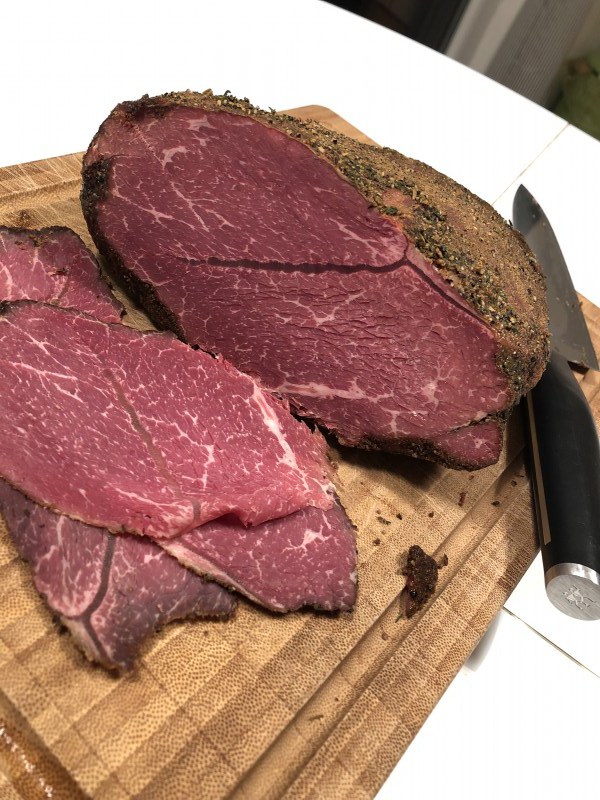
Where is `knife handle`? Image resolution: width=600 pixels, height=800 pixels. knife handle is located at coordinates (218, 746).